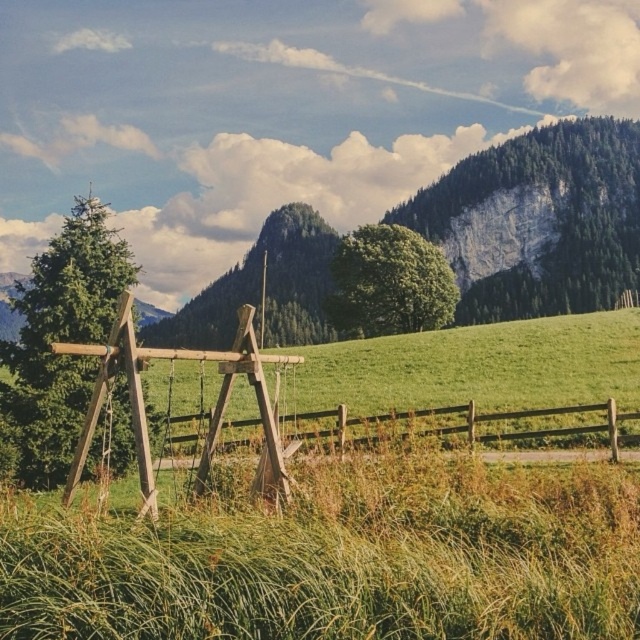
Can you confirm if green grassy at center is shorter than brown wooden fence at center?

Indeed, green grassy at center has a lesser height compared to brown wooden fence at center.

Is green grassy at center further to the viewer compared to brown wooden fence at center?

No.

In order to click on green grassy at center in this screenshot , I will do `click(346, 561)`.

You are a GUI agent. You are given a task and a screenshot of the screen. Output one action in this format:
    pyautogui.click(x=<x>, y=<y>)
    Task: Click on the green grassy at center
    
    Given the screenshot: What is the action you would take?
    pyautogui.click(x=346, y=561)